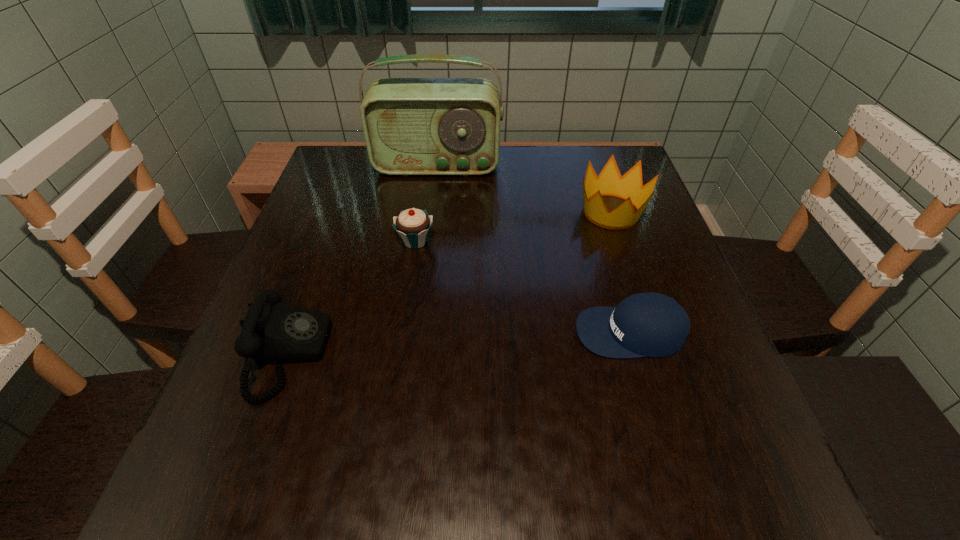
Locate an element on the screen. blank region between the cupcake and the farthest object is located at coordinates (426, 204).

Locate an element on the screen. This screenshot has width=960, height=540. vacant area that lies between the telephone and the cupcake is located at coordinates [352, 298].

Image resolution: width=960 pixels, height=540 pixels. Identify the location of blank region between the cupcake and the telephone. (352, 298).

At what (x,y) coordinates should I click in order to perform the action: click on unoccupied area between the crown and the telephone. Please return your answer as a coordinate pair (x, y). Looking at the image, I should click on (450, 283).

Identify the location of vacant space that is in between the crown and the telephone. [x=450, y=283].

This screenshot has height=540, width=960. I want to click on vacant space that's between the baseball cap and the telephone, so click(460, 343).

Locate an element on the screen. unoccupied area between the baseball cap and the cupcake is located at coordinates (523, 287).

The height and width of the screenshot is (540, 960). I want to click on free area in between the baseball cap and the cupcake, so click(523, 287).

Locate which object ranks fourth in proximity to the baseball cap. Please provide its 2D coordinates. Your answer should be formatted as a tuple, i.e. [(x, y)], where the tuple contains the x and y coordinates of a point satisfying the conditions above.

[(412, 126)]

You are a GUI agent. You are given a task and a screenshot of the screen. Output one action in this format:
    pyautogui.click(x=<x>, y=<y>)
    Task: Click on the fourth closest object to the crown
    
    Given the screenshot: What is the action you would take?
    pyautogui.click(x=272, y=331)